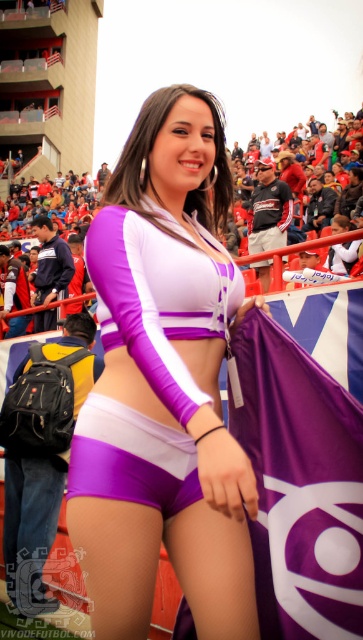
Based on the photo, does purple matte shorts at center appear on the right side of purple satin shorts at center?

Yes, purple matte shorts at center is to the right of purple satin shorts at center.

Is purple matte shorts at center further to camera compared to purple satin shorts at center?

No, purple matte shorts at center is closer to the viewer.

Is point (185, 330) in front of point (193, 483)?

That is False.

I want to click on purple matte shorts at center, so click(164, 385).

Does purple fabric flag at center appear under purple satin shorts at center?

Indeed, purple fabric flag at center is positioned under purple satin shorts at center.

Who is higher up, purple fabric flag at center or purple satin shorts at center?

purple satin shorts at center

Which is in front, point (282, 609) or point (128, 461)?

Point (282, 609)

Locate an element on the screen. purple fabric flag at center is located at coordinates (299, 483).

Does purple matte shorts at center come behind purple fabric flag at center?

No, it is not.

Between point (135, 586) and point (270, 385), which one is positioned behind?

Positioned behind is point (270, 385).

Where is `purple matte shorts at center`? This screenshot has height=640, width=363. purple matte shorts at center is located at coordinates (164, 385).